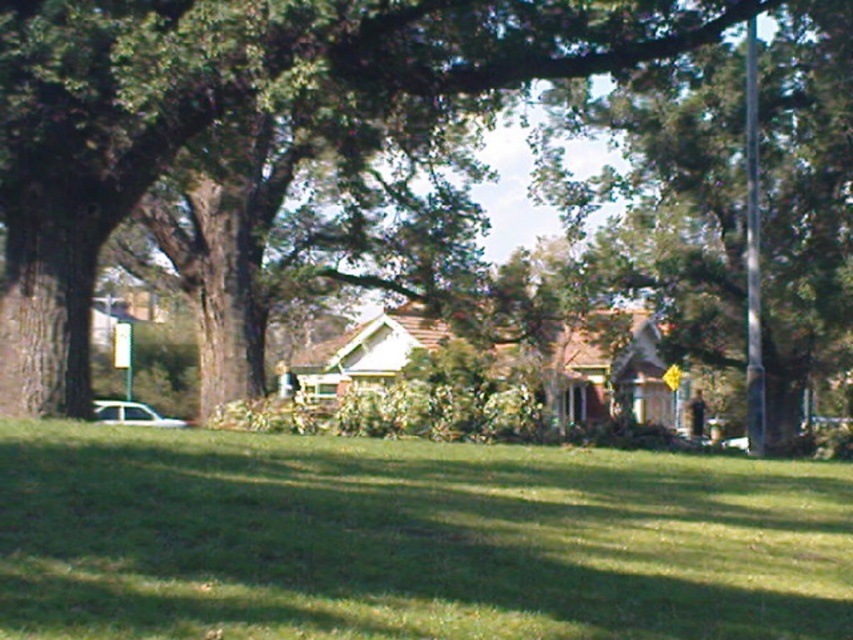
Question: Is green grass at lower center above green leafy tree at center?

Choices:
 (A) yes
 (B) no

Answer: (B)

Question: Which point appears closest to the camera in this image?

Choices:
 (A) (361, 460)
 (B) (621, 19)

Answer: (A)

Question: In this image, where is green grass at lower center located relative to green leafy tree at center?

Choices:
 (A) below
 (B) above

Answer: (A)

Question: Can you confirm if green grass at lower center is bigger than green leafy tree at center?

Choices:
 (A) no
 (B) yes

Answer: (A)

Question: Among these objects, which one is farthest from the camera?

Choices:
 (A) green leafy tree at center
 (B) green grass at lower center

Answer: (A)